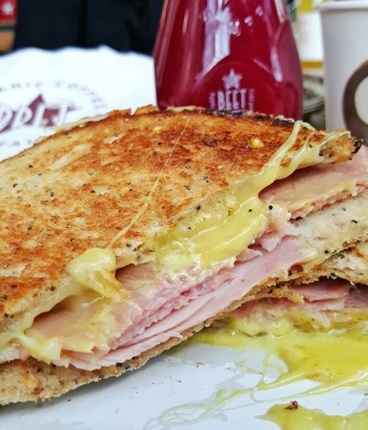
Locate an element on the screen. The width and height of the screenshot is (368, 430). cup is located at coordinates (346, 57).